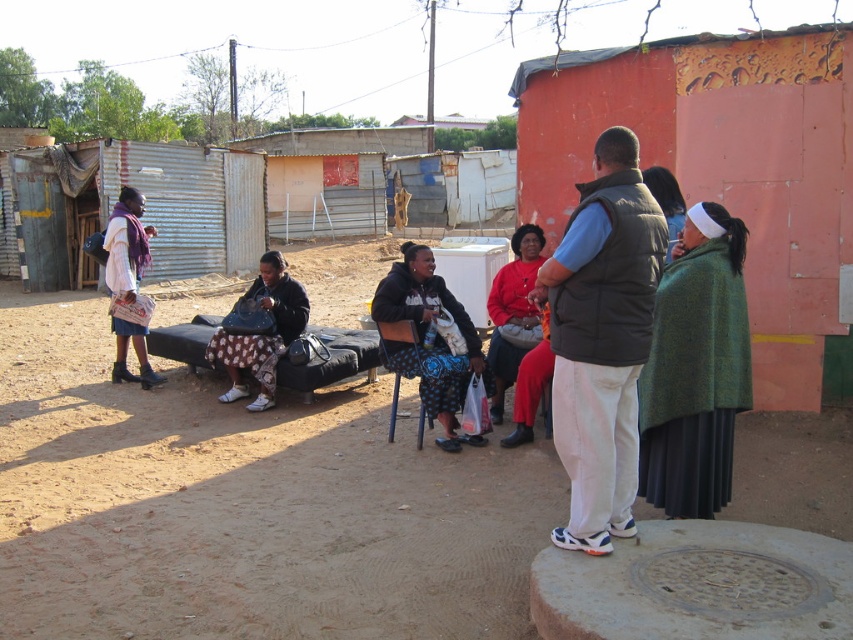
Who is taller, matte purple scarf at left or green woolen shawl at center?

Standing taller between the two is matte purple scarf at left.

Does matte purple scarf at left have a lesser width compared to green woolen shawl at center?

Incorrect, matte purple scarf at left's width is not less than green woolen shawl at center's.

Describe the element at coordinates (126, 244) in the screenshot. I see `matte purple scarf at left` at that location.

At what (x,y) coordinates should I click in order to perform the action: click on matte purple scarf at left. Please return your answer as a coordinate pair (x, y). Looking at the image, I should click on (126, 244).

Does green woolen shawl at right have a larger size compared to red fabric skirt at center?

No.

Does green woolen shawl at right appear on the left side of red fabric skirt at center?

No, green woolen shawl at right is not to the left of red fabric skirt at center.

Identify the location of green woolen shawl at right. The width and height of the screenshot is (853, 640). (695, 369).

Find the location of a particular element. The width and height of the screenshot is (853, 640). green woolen shawl at right is located at coordinates (695, 369).

Does green woolen shawl at right have a greater height compared to matte black jacket at center?

Correct, green woolen shawl at right is much taller as matte black jacket at center.

Based on the photo, can you confirm if green woolen shawl at right is bigger than matte black jacket at center?

No.

Where is `green woolen shawl at right`? This screenshot has width=853, height=640. green woolen shawl at right is located at coordinates (695, 369).

Locate an element on the screen. Image resolution: width=853 pixels, height=640 pixels. green woolen shawl at right is located at coordinates (695, 369).